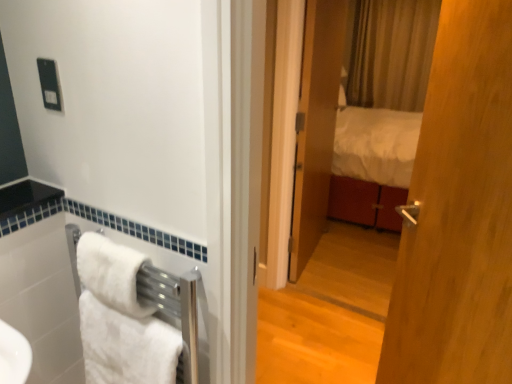
Question: In terms of width, does white fluffy towel at lower left, which is counted as the 1th towel/napkin, starting from the bottom, look wider or thinner when compared to black plastic outlet at upper left?

Choices:
 (A) thin
 (B) wide

Answer: (B)

Question: Considering their positions, is white fluffy towel at lower left, which is counted as the 1th towel/napkin, starting from the bottom, located in front of or behind black plastic outlet at upper left?

Choices:
 (A) behind
 (B) front

Answer: (B)

Question: Based on their relative distances, which object is farther from the white soft towel at lower left, which is the 1th towel/napkin in top-to-bottom order?

Choices:
 (A) wooden door at center
 (B) white fluffy towel at lower left, the 2th towel/napkin viewed from the top
 (C) matte wooden mirror at center
 (D) black plastic outlet at upper left

Answer: (C)

Question: Which of these objects is positioned farthest from the wooden door at center?

Choices:
 (A) black plastic outlet at upper left
 (B) matte wooden mirror at center
 (C) white fluffy towel at lower left, which is counted as the 1th towel/napkin, starting from the bottom
 (D) white soft towel at lower left, which is the 1th towel/napkin in top-to-bottom order

Answer: (A)